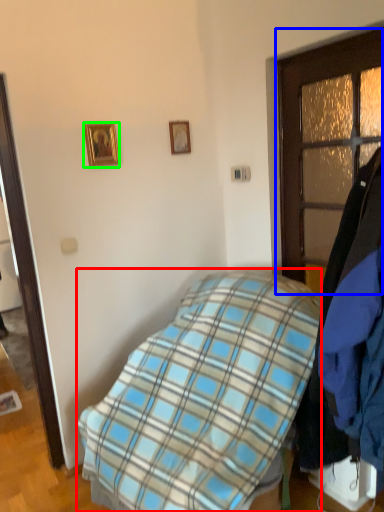
Question: Which is nearer to the bed (highlighted by a red box)? door (highlighted by a blue box) or picture frame (highlighted by a green box).

Choices:
 (A) door
 (B) picture frame

Answer: (A)